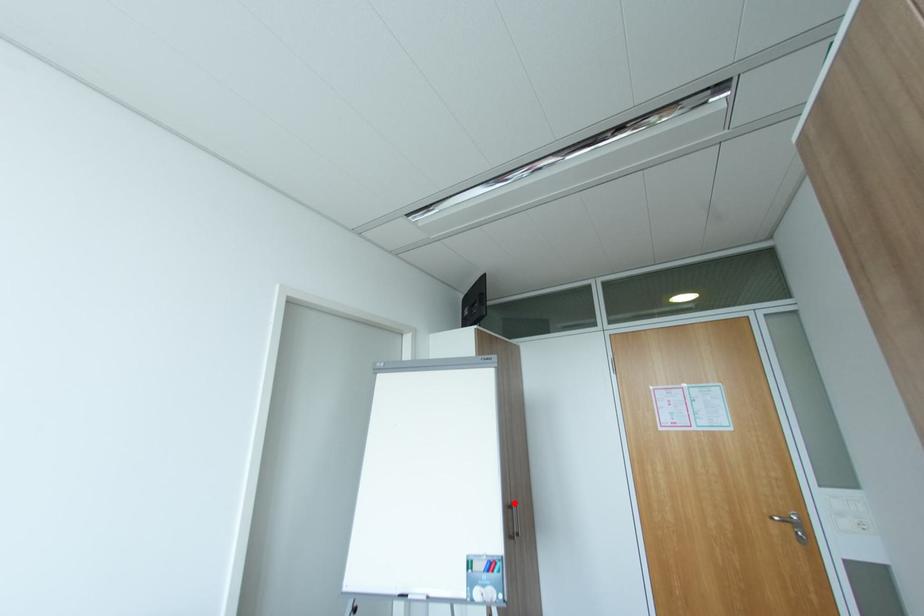
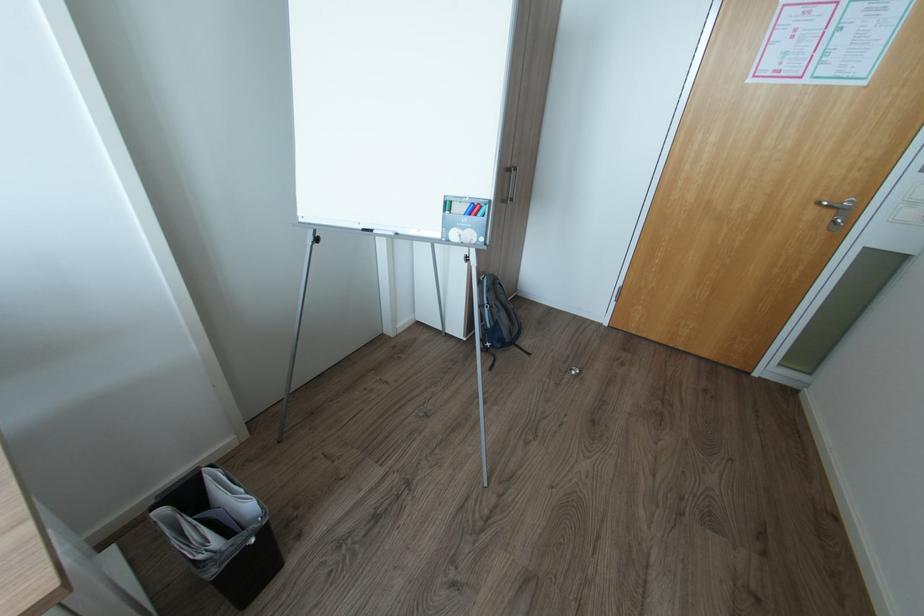
Locate, in the second image, the point that corresponds to the highlighted location in the first image.

(514, 166)